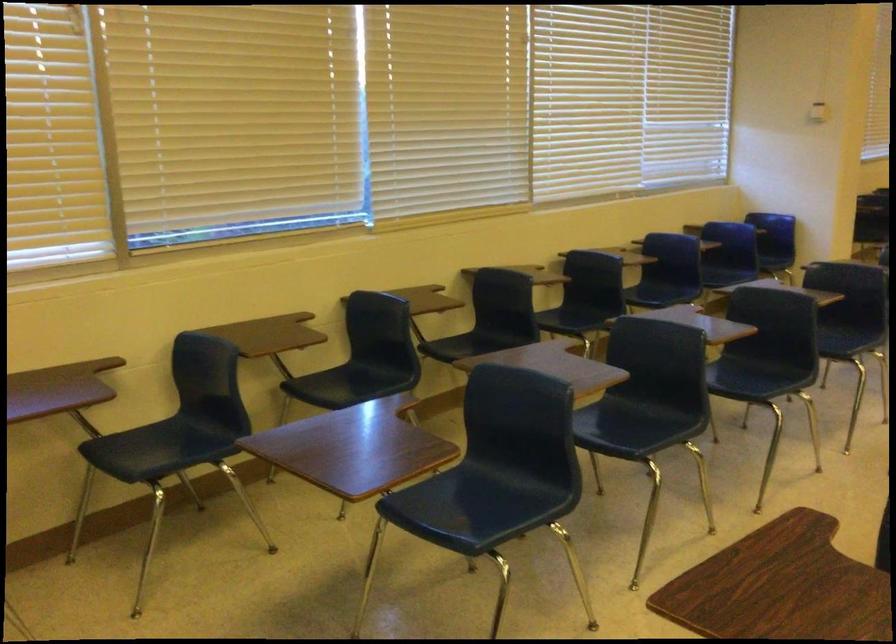
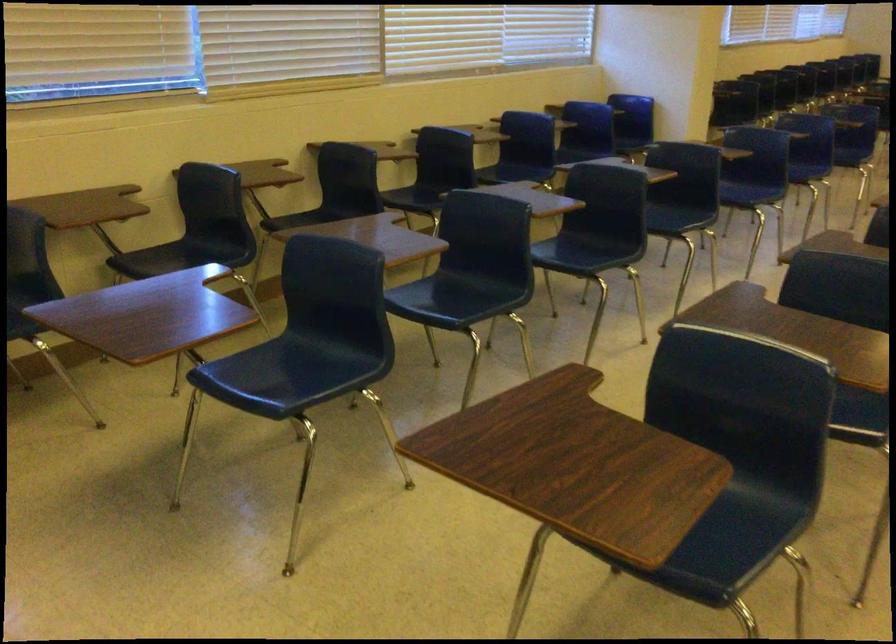
Locate, in the second image, the point that corresponds to (630,418) in the first image.

(462, 292)